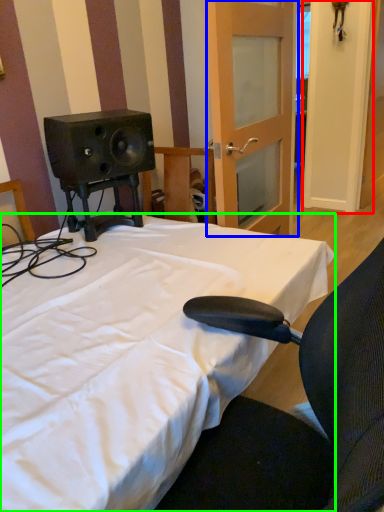
Question: Which is nearer to the door (highlighted by a red box)? door (highlighted by a blue box) or bed (highlighted by a green box).

Choices:
 (A) door
 (B) bed

Answer: (A)